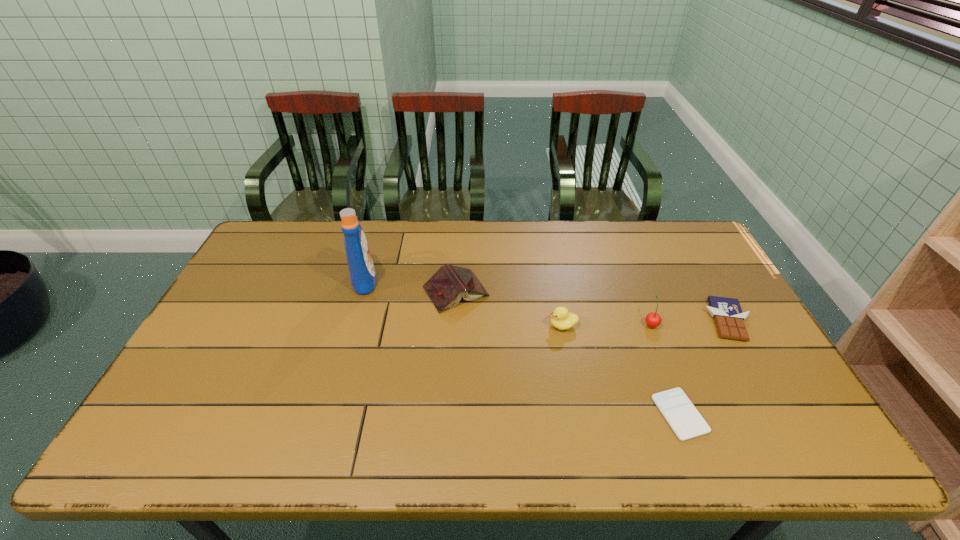
Where is `empty space that is in between the fourth tallest object and the tallest object`? The width and height of the screenshot is (960, 540). empty space that is in between the fourth tallest object and the tallest object is located at coordinates (410, 285).

At what (x,y) coordinates should I click in order to perform the action: click on vacant point located between the chocolate bar and the shortest object. Please return your answer as a coordinate pair (x, y). The image size is (960, 540). Looking at the image, I should click on (704, 367).

What are the coordinates of `unoccupied position between the tallest object and the nearest object` in the screenshot? It's located at (522, 347).

Find the location of `vacant point located between the second tallest object and the duckling`. vacant point located between the second tallest object and the duckling is located at coordinates (607, 325).

Where is `vacant area that lies between the third object from left to right and the fifth object from right to left`? This screenshot has width=960, height=540. vacant area that lies between the third object from left to right and the fifth object from right to left is located at coordinates (509, 308).

I want to click on the fourth closest object to the fourth object from right to left, so click(x=727, y=313).

At what (x,y) coordinates should I click in order to perform the action: click on object that ranks as the fifth closest to the cherry. Please return your answer as a coordinate pair (x, y). The image size is (960, 540). Looking at the image, I should click on (361, 268).

You are a GUI agent. You are given a task and a screenshot of the screen. Output one action in this format:
    pyautogui.click(x=<x>, y=<y>)
    Task: Click on the vacant region that satisfies the following two spatial constraints: 1. on the front side of the nearest object; 2. on the left side of the third shortest object
    This screenshot has width=960, height=540.
    Given the screenshot: What is the action you would take?
    448,414

Identify the location of vacant space that satisfies the following two spatial constraints: 1. on the back side of the nearest object; 2. on the label of the leftmost object. This screenshot has width=960, height=540. (630, 280).

At what (x,y) coordinates should I click in order to perform the action: click on free region that satisfies the following two spatial constraints: 1. on the label of the second tallest object; 2. on the left side of the detergent. Please return your answer as a coordinate pair (x, y). The width and height of the screenshot is (960, 540). Looking at the image, I should click on (351, 324).